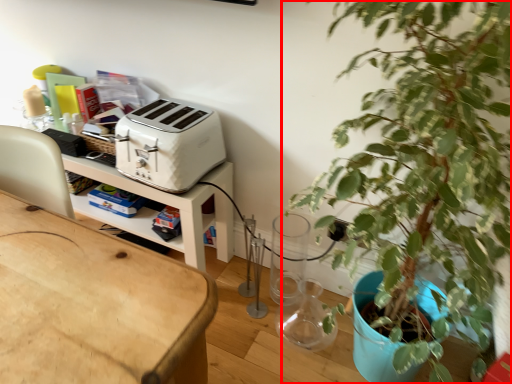
Question: Observing the image, what is the correct spatial positioning of houseplant (annotated by the red box) in reference to toaster?

Choices:
 (A) left
 (B) right

Answer: (B)